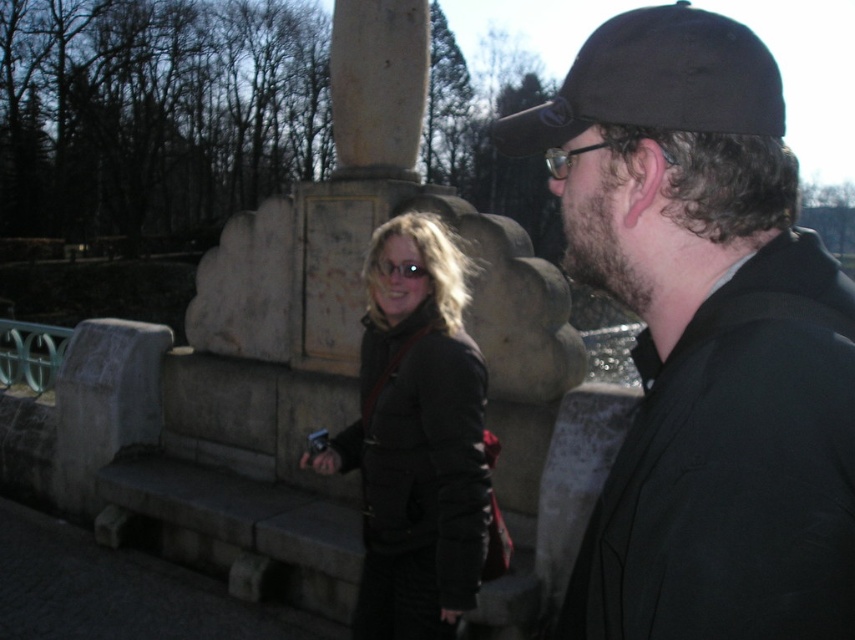
Question: Is matte black jacket at center closer to camera compared to black fabric baseball cap at upper right?

Choices:
 (A) yes
 (B) no

Answer: (B)

Question: Based on their relative distances, which object is farther from the black fabric baseball cap at upper right?

Choices:
 (A) matte black jacket at center
 (B) black matte cap at upper right

Answer: (B)

Question: Does black matte cap at upper right come behind matte black jacket at center?

Choices:
 (A) yes
 (B) no

Answer: (B)

Question: Which point is farther to the camera?

Choices:
 (A) matte black jacket at center
 (B) black matte cap at upper right
 (C) black fabric baseball cap at upper right

Answer: (A)

Question: Which point is closer to the camera?

Choices:
 (A) matte black jacket at center
 (B) black fabric baseball cap at upper right

Answer: (B)

Question: Can you confirm if black matte cap at upper right is positioned to the left of black fabric baseball cap at upper right?

Choices:
 (A) no
 (B) yes

Answer: (B)